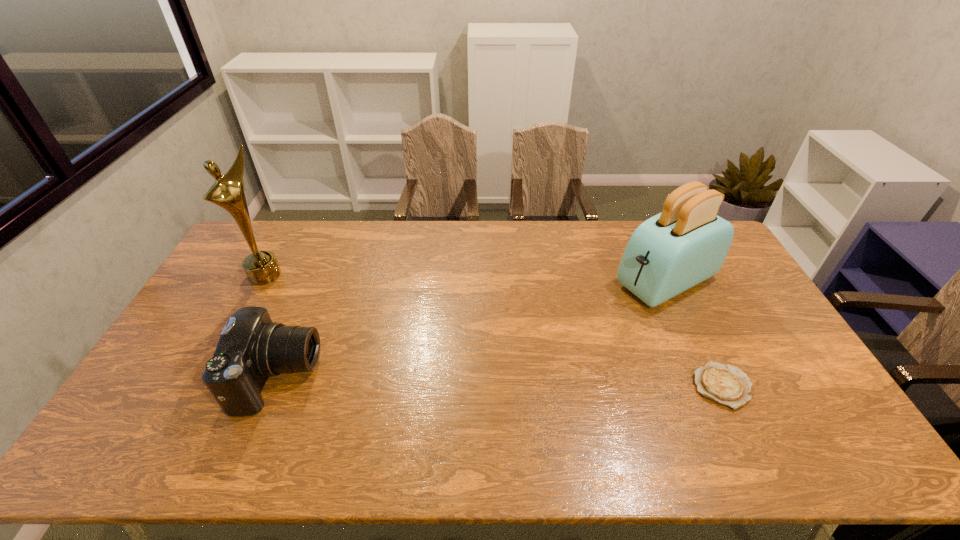
Find the location of a particular element. The image size is (960, 540). the third tallest object is located at coordinates (251, 348).

At what (x,y) coordinates should I click in order to perform the action: click on the second object from left to right. Please return your answer as a coordinate pair (x, y). The height and width of the screenshot is (540, 960). Looking at the image, I should click on (251, 348).

Find the location of `the shortest object`. the shortest object is located at coordinates (727, 385).

The image size is (960, 540). I want to click on the third shortest object, so click(x=687, y=243).

The image size is (960, 540). Find the location of `the leftmost object`. the leftmost object is located at coordinates (228, 191).

Identify the location of award. (228, 191).

Locate an element on the screen. vacant space located on the lens of the second shortest object is located at coordinates (373, 377).

The height and width of the screenshot is (540, 960). What are the coordinates of `free space located 0.400m on the back of the quiche` in the screenshot? It's located at (666, 269).

At what (x,y) coordinates should I click in order to perform the action: click on vacant region located 0.380m on the side of the toaster with the lever. Please return your answer as a coordinate pair (x, y). The height and width of the screenshot is (540, 960). Looking at the image, I should click on (532, 346).

Where is `vacant space located 0.320m on the side of the toaster with the lever`? This screenshot has height=540, width=960. vacant space located 0.320m on the side of the toaster with the lever is located at coordinates (548, 338).